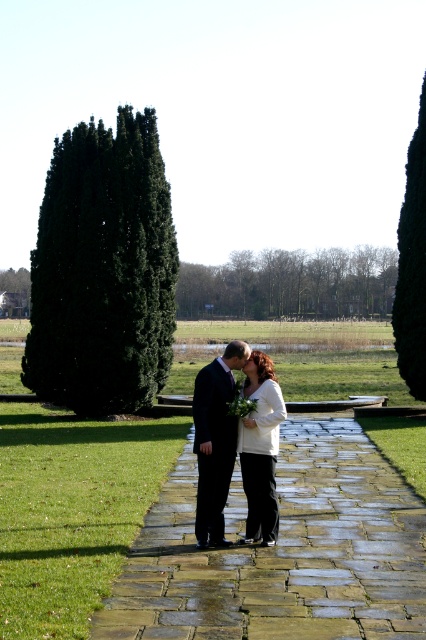
Does dark green coniferous tree at left appear under green leafy tree at center?

Yes.

Is dark green coniferous tree at left positioned before green leafy tree at center?

That is True.

You are a GUI agent. You are given a task and a screenshot of the screen. Output one action in this format:
    pyautogui.click(x=<x>, y=<y>)
    Task: Click on the dark green coniferous tree at left
    This screenshot has height=640, width=426.
    Given the screenshot: What is the action you would take?
    pyautogui.click(x=103, y=269)

Where is `dark green coniferous tree at left`? The width and height of the screenshot is (426, 640). dark green coniferous tree at left is located at coordinates (103, 269).

Who is lower down, dark green coniferous tree at left or shiny black suit at center?

shiny black suit at center is below.

Between dark green coniferous tree at left and shiny black suit at center, which one appears on the left side from the viewer's perspective?

Positioned to the left is dark green coniferous tree at left.

Between point (36, 394) and point (233, 369), which one is positioned behind?

The point (36, 394) is behind.

I want to click on dark green coniferous tree at left, so click(x=103, y=269).

Can you confirm if green leafy tree at center is positioned above white matte dress at center?

Indeed, green leafy tree at center is positioned over white matte dress at center.

Does green leafy tree at center come behind white matte dress at center?

Yes, it is.

At what (x,y) coordinates should I click in order to perform the action: click on green leafy tree at center. Please return your answer as a coordinate pair (x, y). The width and height of the screenshot is (426, 640). Looking at the image, I should click on (290, 284).

Identify the location of green leafy tree at center. (290, 284).